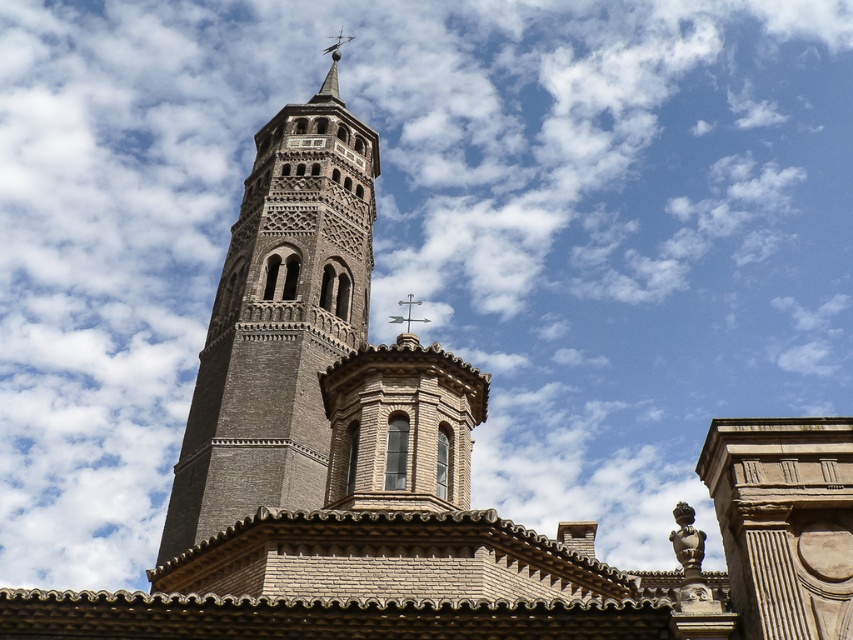
Question: Does brown textured stone bell tower at center have a lesser width compared to polished silver spire at upper center?

Choices:
 (A) no
 (B) yes

Answer: (B)

Question: Among these objects, which one is nearest to the camera?

Choices:
 (A) polished silver spire at upper center
 (B) brown textured stone bell tower at center

Answer: (B)

Question: Which point is farther to the camera?

Choices:
 (A) polished silver spire at upper center
 (B) brown textured stone bell tower at center

Answer: (A)

Question: Which point is closer to the camera?

Choices:
 (A) polished silver spire at upper center
 (B) brown textured stone bell tower at center

Answer: (B)

Question: Is brown textured stone bell tower at center thinner than polished silver spire at upper center?

Choices:
 (A) yes
 (B) no

Answer: (A)

Question: Is brown textured stone bell tower at center closer to the viewer compared to polished silver spire at upper center?

Choices:
 (A) yes
 (B) no

Answer: (A)